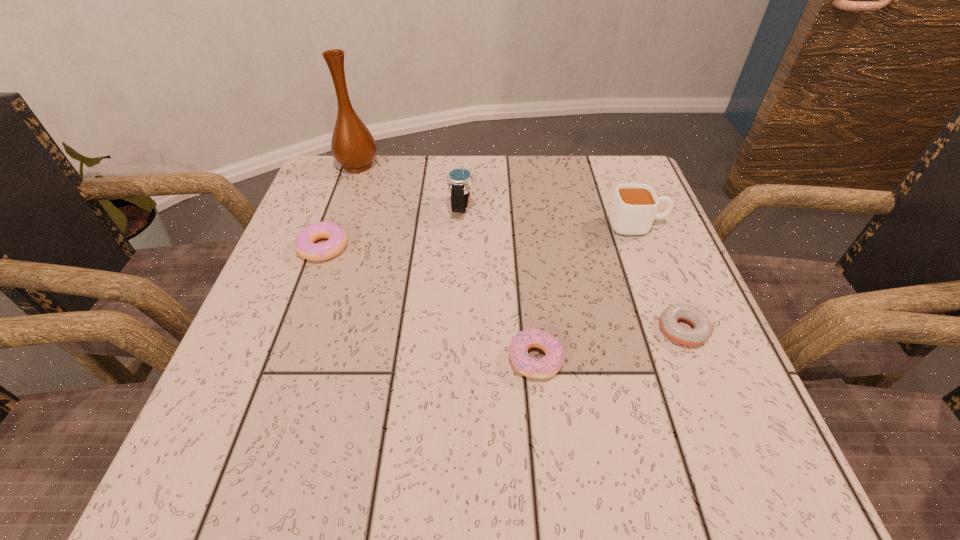
At what (x,y) coordinates should I click in order to perform the action: click on vacant point located between the farthest doughnut and the vase. Please return your answer as a coordinate pair (x, y). Looking at the image, I should click on (341, 206).

Locate an element on the screen. This screenshot has height=540, width=960. empty location between the shortest object and the farthest object is located at coordinates (520, 247).

At what (x,y) coordinates should I click in order to perform the action: click on vacant space in between the vase and the cup. Please return your answer as a coordinate pair (x, y). Looking at the image, I should click on pyautogui.click(x=498, y=195).

You are a GUI agent. You are given a task and a screenshot of the screen. Output one action in this format:
    pyautogui.click(x=<x>, y=<y>)
    Task: Click on the free spot between the fourth object from left to right and the fourth object from right to left
    
    Given the screenshot: What is the action you would take?
    pyautogui.click(x=499, y=283)

Identify the location of empty space between the farthest doughnut and the vase. This screenshot has width=960, height=540. (341, 206).

Locate an element on the screen. The width and height of the screenshot is (960, 540). vacant region between the rightmost doughnut and the cup is located at coordinates (660, 277).

Choose which object is the second nearest neighbor to the farthest object. Please provide its 2D coordinates. Your answer should be formatted as a tuple, i.e. [(x, y)], where the tuple contains the x and y coordinates of a point satisfying the conditions above.

[(304, 244)]

Identify which object is located as the fifth nearest to the third object from left to right. Please provide its 2D coordinates. Your answer should be formatted as a tuple, i.e. [(x, y)], where the tuple contains the x and y coordinates of a point satisfying the conditions above.

[(702, 328)]

Where is `doughnut that can be found as the closest to the cup`? doughnut that can be found as the closest to the cup is located at coordinates (702, 328).

Where is `doughnut that is the second closest to the third object from right to left`? The width and height of the screenshot is (960, 540). doughnut that is the second closest to the third object from right to left is located at coordinates (304, 244).